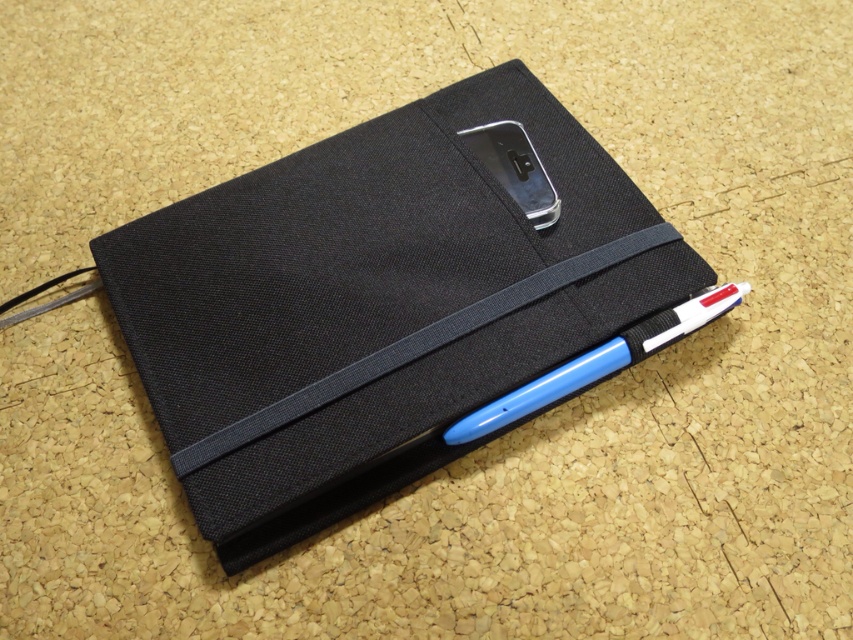
You are organizing your desk and need to place the black fabric notebook at center and the blue plastic pen at lower right into a drawer. The drawer has a height limit of 10 cm. Can both items fit vertically without bending or damaging them?

The black fabric notebook at center is taller than the blue plastic pen at lower right. Since the drawer has a height limit of 10 cm, we need to know the exact height of the notebook. However, the description only states that the notebook is taller than the pen, but doesn not provide specific measurements. Therefore, it is uncertain if both items can fit vertically without bending or damaging them.

Looking at this image, what object is located at the point marked by coordinates (x=374, y=304) in the image?

The point marked by coordinates (x=374, y=304) is located on the black fabric notebook at center.